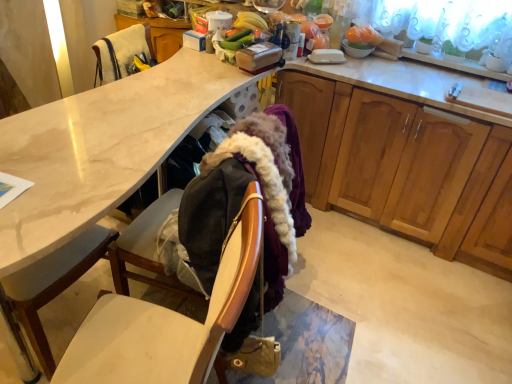
The height and width of the screenshot is (384, 512). What do you see at coordinates (100, 148) in the screenshot?
I see `matte white desk at center` at bounding box center [100, 148].

Describe the element at coordinates (166, 322) in the screenshot. This screenshot has width=512, height=384. I see `wooden chair at lower left` at that location.

This screenshot has width=512, height=384. Identify the location of matte white cup at upper center. (216, 28).

What do you see at coordinates (216, 28) in the screenshot?
I see `matte white cup at upper center` at bounding box center [216, 28].

What do you see at coordinates (424, 45) in the screenshot? The width and height of the screenshot is (512, 384). I see `green matte plant at upper right` at bounding box center [424, 45].

What is the approximate width of green matte plant at upper right?

green matte plant at upper right is 7.70 centimeters in width.

Measure the distance between white glossy bowl at upper right and camera.

white glossy bowl at upper right and camera are 7.52 feet apart.

At what (x,y) coordinates should I click in order to perform the action: click on matte white desk at center. Please return your answer as a coordinate pair (x, y). Image resolution: width=512 pixels, height=384 pixels. Looking at the image, I should click on (100, 148).

Considering the sizes of orange plastic bag at upper right and white glossy plate at upper center in the image, is orange plastic bag at upper right wider or thinner than white glossy plate at upper center?

Considering their sizes, orange plastic bag at upper right looks slimmer than white glossy plate at upper center.

Which object is further away from the camera taking this photo, orange plastic bag at upper right or white glossy plate at upper center?

white glossy plate at upper center is further from the camera.

Is orange plastic bag at upper right positioned with its back to white glossy plate at upper center?

That's not correct — orange plastic bag at upper right is not looking away from white glossy plate at upper center.

Is orange plastic bag at upper right at the right side of white glossy plate at upper center?

Yes, orange plastic bag at upper right is to the right of white glossy plate at upper center.

How different are the orientations of white glossy plate at upper center and wooden chair at lower left in degrees?

The angular difference between white glossy plate at upper center and wooden chair at lower left is 19.7 degrees.

Is white glossy plate at upper center facing towards wooden chair at lower left?

No, white glossy plate at upper center is not turned towards wooden chair at lower left.

Does white glossy plate at upper center appear on the left side of wooden chair at lower left?

No, white glossy plate at upper center is not to the left of wooden chair at lower left.

Does white glossy plate at upper center have a greater width compared to velvet-like fabric armchair at upper left?

In fact, white glossy plate at upper center might be narrower than velvet-like fabric armchair at upper left.

Which is less distant, (312, 53) or (148, 52)?

The point (148, 52) is closer to the camera.

Which is more to the right, white glossy plate at upper center or velvet-like fabric armchair at upper left?

From the viewer's perspective, white glossy plate at upper center appears more on the right side.

From a real-world perspective, which object stands above the other?

white glossy plate at upper center, from a real-world perspective.

Does point (348, 40) appear closer or farther from the camera than point (348, 44)?

Point (348, 40).

Is orange plastic bag at upper right closer to the viewer compared to white glossy bowl at upper right?

Yes.

From the picture: Considering the sizes of objects orange plastic bag at upper right and white glossy bowl at upper right in the image provided, who is bigger, orange plastic bag at upper right or white glossy bowl at upper right?

With larger size is orange plastic bag at upper right.

Does orange plastic bag at upper right have a greater height compared to white glossy bowl at upper right?

Yes.

In the scene shown: Between white glossy plate at upper center and white glossy bowl at upper right, which one has less height?

With less height is white glossy bowl at upper right.

Which of these two, white glossy plate at upper center or white glossy bowl at upper right, is bigger?

With larger size is white glossy bowl at upper right.

Is white glossy plate at upper center far away from white glossy bowl at upper right?

No.

Is white glossy plate at upper center aimed at white glossy bowl at upper right?

No.

Looking at this image, which of these two, wooden cabinets at right or orange plastic bag at upper right, stands shorter?

orange plastic bag at upper right.

Are wooden cabinets at right and orange plastic bag at upper right located far from each other?

No.

Is wooden cabinets at right to the left of orange plastic bag at upper right from the viewer's perspective?

No.

How much distance is there between wooden cabinets at right and orange plastic bag at upper right?

The distance of wooden cabinets at right from orange plastic bag at upper right is 27.07 inches.

Based on the photo, from a real-world perspective, is orange plastic bag at upper right under velvet-like fabric armchair at upper left?

No, from a real-world perspective, orange plastic bag at upper right is not beneath velvet-like fabric armchair at upper left.

Based on their sizes in the image, would you say orange plastic bag at upper right is bigger or smaller than velvet-like fabric armchair at upper left?

Clearly, orange plastic bag at upper right is smaller in size than velvet-like fabric armchair at upper left.

Is orange plastic bag at upper right in contact with velvet-like fabric armchair at upper left?

No, orange plastic bag at upper right is not in contact with velvet-like fabric armchair at upper left.

From the image's perspective, is orange plastic bag at upper right located above velvet-like fabric armchair at upper left?

Yes.

Identify the location of plate below the orange plastic bag at upper right (from a real-world perspective). Image resolution: width=512 pixels, height=384 pixels. tap(327, 56).

Find the location of a particular element. This screenshot has width=512, height=384. plate positioned vertically above the wooden chair at lower left (from a real-world perspective) is located at coordinates (327, 56).

Considering their positions, is wooden chair at lower left positioned closer to white glossy plate at upper center than matte white desk at center?

Among the two, matte white desk at center is located nearer to white glossy plate at upper center.

Based on their spatial positions, is white glossy bowl at upper right or orange plastic bag at upper right closer to white glossy plate at upper center?

Based on the image, white glossy bowl at upper right appears to be nearer to white glossy plate at upper center.

Considering their positions, is wooden chair at lower left positioned closer to orange plastic bag at upper right than wooden cabinets at right?

wooden cabinets at right is positioned closer to the anchor orange plastic bag at upper right.

Estimate the real-world distances between objects in this image. Which object is further from white glossy plate at upper center, matte white cup at upper center or green matte plant at upper right?

matte white cup at upper center lies further to white glossy plate at upper center than the other object.

Based on their spatial positions, is orange plastic bag at upper right or velvet-like fabric armchair at upper left further from white glossy plate at upper center?

Among the two, velvet-like fabric armchair at upper left is located further to white glossy plate at upper center.

When comparing their distances from orange plastic bag at upper right, does velvet-like fabric armchair at upper left or white glossy bowl at upper right seem closer?

white glossy bowl at upper right lies closer to orange plastic bag at upper right than the other object.

Looking at the image, which one is located further to orange plastic bag at upper right, matte white desk at center or wooden cabinets at right?

matte white desk at center is positioned further to the anchor orange plastic bag at upper right.

Looking at the image, which one is located closer to wooden chair at lower left, green matte plant at upper right or wooden cabinets at right?

Among the two, wooden cabinets at right is located nearer to wooden chair at lower left.

This screenshot has height=384, width=512. Find the location of `tableware located between white glossy plate at upper center and orange plastic bag at upper right in the left-right direction`. tableware located between white glossy plate at upper center and orange plastic bag at upper right in the left-right direction is located at coordinates (355, 51).

You are a GUI agent. You are given a task and a screenshot of the screen. Output one action in this format:
    pyautogui.click(x=<x>, y=<y>)
    Task: Click on the cabinetry between matte white desk at center and white glossy bowl at upper right along the z-axis
    The image size is (512, 384).
    Given the screenshot: What is the action you would take?
    point(406,168)

Where is `kitchen appliance between wooden chair at lower left and white glossy bowl at upper right in the front-back direction`? Image resolution: width=512 pixels, height=384 pixels. kitchen appliance between wooden chair at lower left and white glossy bowl at upper right in the front-back direction is located at coordinates (x=216, y=28).

Find the location of `kitchen appliance situated between matte white desk at center and wooden cabinets at right from left to right`. kitchen appliance situated between matte white desk at center and wooden cabinets at right from left to right is located at coordinates (216, 28).